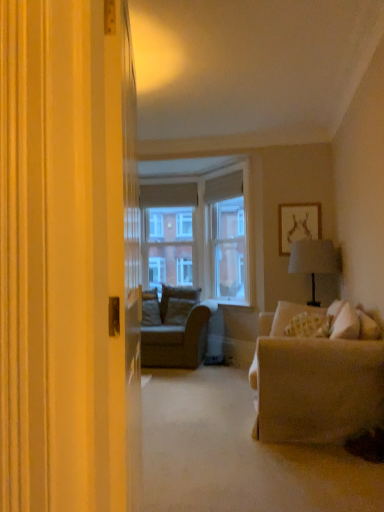
Question: Is patterned fabric pillow at right, which is the second pillow from back to front, facing towards white matte picture frame at upper right?

Choices:
 (A) no
 (B) yes

Answer: (A)

Question: Does patterned fabric pillow at right, positioned as the first pillow in front-to-back order, contain white matte picture frame at upper right?

Choices:
 (A) no
 (B) yes

Answer: (A)

Question: Considering the relative sizes of patterned fabric pillow at right, which is the second pillow from back to front, and white matte picture frame at upper right in the image provided, is patterned fabric pillow at right, which is the second pillow from back to front, shorter than white matte picture frame at upper right?

Choices:
 (A) yes
 (B) no

Answer: (A)

Question: Can you confirm if patterned fabric pillow at right, marked as the 1th pillow in a right-to-left arrangement, is smaller than white matte picture frame at upper right?

Choices:
 (A) yes
 (B) no

Answer: (B)

Question: Can you confirm if patterned fabric pillow at right, the second pillow viewed from the left, is bigger than white matte picture frame at upper right?

Choices:
 (A) yes
 (B) no

Answer: (A)

Question: Considering the relative sizes of patterned fabric pillow at right, the second pillow viewed from the left, and white matte picture frame at upper right in the image provided, is patterned fabric pillow at right, the second pillow viewed from the left, thinner than white matte picture frame at upper right?

Choices:
 (A) no
 (B) yes

Answer: (A)

Question: Does clear glass window screen at center, acting as the second window screen starting from the left, have a lesser height compared to white matte picture frame at upper right?

Choices:
 (A) no
 (B) yes

Answer: (A)

Question: Is clear glass window screen at center, acting as the second window screen starting from the left, positioned with its back to white matte picture frame at upper right?

Choices:
 (A) yes
 (B) no

Answer: (B)

Question: Is clear glass window screen at center, the first window screen from the right, surrounding white matte picture frame at upper right?

Choices:
 (A) yes
 (B) no

Answer: (B)

Question: Can you confirm if clear glass window screen at center, which is the 2th window screen from back to front, is bigger than white matte picture frame at upper right?

Choices:
 (A) no
 (B) yes

Answer: (B)

Question: Does clear glass window screen at center, which is the 2th window screen from back to front, appear on the left side of white matte picture frame at upper right?

Choices:
 (A) yes
 (B) no

Answer: (A)

Question: Are clear glass window screen at center, which is the 2th window screen from back to front, and white matte picture frame at upper right beside each other?

Choices:
 (A) yes
 (B) no

Answer: (B)

Question: Is patterned fabric pillow at right, positioned as the first pillow in front-to-back order, facing away from clear glass window screen at center, which appears as the first window screen when viewed from the back?

Choices:
 (A) yes
 (B) no

Answer: (B)